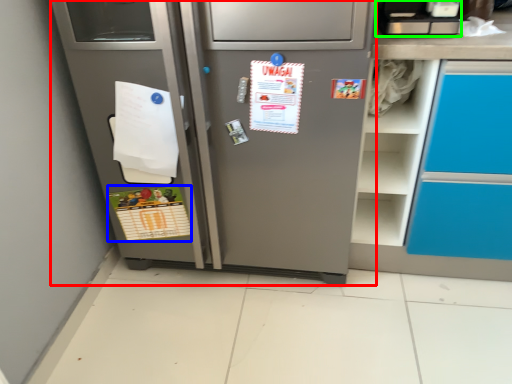
Question: Considering the real-world distances, which object is closest to refrigerator (highlighted by a red box)? postcard (highlighted by a blue box) or appliance (highlighted by a green box).

Choices:
 (A) postcard
 (B) appliance

Answer: (A)